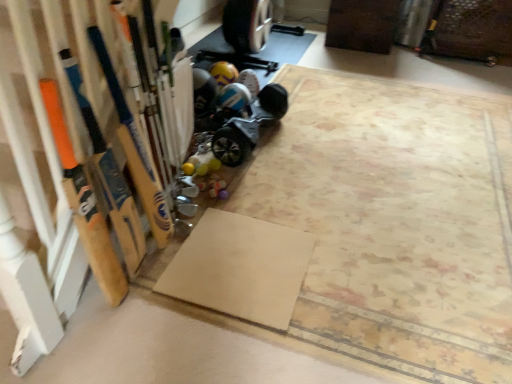
What do you see at coordinates (84, 204) in the screenshot?
I see `wooden baseball bat at left, the first baseball bat when ordered from left to right` at bounding box center [84, 204].

What do you see at coordinates (243, 107) in the screenshot?
I see `blue metallic hoverboard at lower center` at bounding box center [243, 107].

You are a GUI agent. You are given a task and a screenshot of the screen. Output one action in this format:
    pyautogui.click(x=<x>, y=<y>)
    Task: Click on the beige matte yoga mat at lower center
    
    Given the screenshot: What is the action you would take?
    pyautogui.click(x=240, y=268)

From a real-world perspective, is wooden baseball bat at left, which is the first baseball bat from right to left, beneath beige matte yoga mat at lower center?

No, from a real-world perspective, wooden baseball bat at left, which is the first baseball bat from right to left, is not below beige matte yoga mat at lower center.

Between wooden baseball bat at left, placed as the 2th baseball bat when sorted from left to right, and beige matte yoga mat at lower center, which one appears on the left side from the viewer's perspective?

From the viewer's perspective, wooden baseball bat at left, placed as the 2th baseball bat when sorted from left to right, appears more on the left side.

Looking at this image, between wooden baseball bat at left, which is the first baseball bat from right to left, and beige matte yoga mat at lower center, which one is positioned in front?

wooden baseball bat at left, which is the first baseball bat from right to left, is more forward.

Can you tell me how much wooden baseball bat at left, which is the first baseball bat from right to left, and beige matte yoga mat at lower center differ in facing direction?

0.312 degrees separate the facing orientations of wooden baseball bat at left, which is the first baseball bat from right to left, and beige matte yoga mat at lower center.

How different are the orientations of beige matte yoga mat at lower center and wooden baseball bat at left, placed as the 2th baseball bat when sorted from left to right, in degrees?

The angle between the facing direction of beige matte yoga mat at lower center and the facing direction of wooden baseball bat at left, placed as the 2th baseball bat when sorted from left to right, is 0.312 degrees.

Is beige matte yoga mat at lower center taller than wooden baseball bat at left, placed as the 2th baseball bat when sorted from left to right?

Incorrect, the height of beige matte yoga mat at lower center is not larger of that of wooden baseball bat at left, placed as the 2th baseball bat when sorted from left to right.

Is beige matte yoga mat at lower center situated inside wooden baseball bat at left, which is the first baseball bat from right to left, or outside?

beige matte yoga mat at lower center is located beyond the bounds of wooden baseball bat at left, which is the first baseball bat from right to left.

From a real-world perspective, which is physically above, beige matte yoga mat at lower center or wooden baseball bat at left, placed as the 2th baseball bat when sorted from left to right?

wooden baseball bat at left, placed as the 2th baseball bat when sorted from left to right, is physically above.

Consider the image. Can you confirm if blue metallic hoverboard at lower center is wider than wooden baseball bat at left, which is the first baseball bat from right to left?

Yes.

Is blue metallic hoverboard at lower center oriented away from wooden baseball bat at left, placed as the 2th baseball bat when sorted from left to right?

No, blue metallic hoverboard at lower center is not facing the opposite direction of wooden baseball bat at left, placed as the 2th baseball bat when sorted from left to right.

Is blue metallic hoverboard at lower center positioned behind wooden baseball bat at left, which is the first baseball bat from right to left?

Yes, blue metallic hoverboard at lower center is further from the camera.

Does wooden baseball bat at left, which ranks as the 2th baseball bat in right-to-left order, come in front of blue metallic hoverboard at lower center?

Yes, it is.

From a real-world perspective, is wooden baseball bat at left, the first baseball bat when ordered from left to right, on top of blue metallic hoverboard at lower center?

Correct, in the physical world, wooden baseball bat at left, the first baseball bat when ordered from left to right, is higher than blue metallic hoverboard at lower center.

Do you think wooden baseball bat at left, the first baseball bat when ordered from left to right, is within blue metallic hoverboard at lower center, or outside of it?

wooden baseball bat at left, the first baseball bat when ordered from left to right, is located beyond the bounds of blue metallic hoverboard at lower center.

What are the coordinates of `car above the wooden baseball bat at left, which ranks as the 2th baseball bat in right-to-left order (from the image's perspective)` in the screenshot? It's located at (243, 107).

From the image's perspective, which one is positioned lower, wooden baseball bat at left, the first baseball bat when ordered from left to right, or beige matte yoga mat at lower center?

beige matte yoga mat at lower center is shown below in the image.

Is there a large distance between wooden baseball bat at left, the first baseball bat when ordered from left to right, and beige matte yoga mat at lower center?

That's not correct — wooden baseball bat at left, the first baseball bat when ordered from left to right, is a little close to beige matte yoga mat at lower center.

Is wooden baseball bat at left, the first baseball bat when ordered from left to right, not within beige matte yoga mat at lower center?

Absolutely, wooden baseball bat at left, the first baseball bat when ordered from left to right, is external to beige matte yoga mat at lower center.

This screenshot has width=512, height=384. In order to click on yoga mat lying in front of the blue metallic hoverboard at lower center in this screenshot , I will do `click(240, 268)`.

How much distance is there between beige matte yoga mat at lower center and blue metallic hoverboard at lower center?

beige matte yoga mat at lower center and blue metallic hoverboard at lower center are 28.90 inches apart.

Is blue metallic hoverboard at lower center surrounded by beige matte yoga mat at lower center?

That's incorrect, blue metallic hoverboard at lower center is not inside beige matte yoga mat at lower center.

Is beige matte yoga mat at lower center turned away from blue metallic hoverboard at lower center?

No.

Could you tell me if blue metallic hoverboard at lower center is turned towards wooden baseball bat at left, which ranks as the 2th baseball bat in right-to-left order?

No, blue metallic hoverboard at lower center is not oriented towards wooden baseball bat at left, which ranks as the 2th baseball bat in right-to-left order.

Locate an element on the screen. The height and width of the screenshot is (384, 512). the 2nd baseball bat to the left of the blue metallic hoverboard at lower center, counting from the anchor's position is located at coordinates (84, 204).

Does blue metallic hoverboard at lower center appear on the left side of wooden baseball bat at left, the first baseball bat when ordered from left to right?

No.

How different are the orientations of blue metallic hoverboard at lower center and wooden baseball bat at left, the first baseball bat when ordered from left to right, in degrees?

They differ by 3.9 degrees in their facing directions.

In order to click on yoga mat lying on the right of wooden baseball bat at left, which is the first baseball bat from right to left in this screenshot , I will do `click(240, 268)`.

From the image's perspective, which baseball bat is the 2nd one above the beige matte yoga mat at lower center? Please provide its 2D coordinates.

[(135, 149)]

Which object lies nearer to the anchor point blue metallic hoverboard at lower center, beige matte yoga mat at lower center or wooden baseball bat at left, which ranks as the 2th baseball bat in right-to-left order?

Based on the image, beige matte yoga mat at lower center appears to be nearer to blue metallic hoverboard at lower center.

When comparing their distances from wooden baseball bat at left, which ranks as the 2th baseball bat in right-to-left order, does wooden baseball bat at left, which is the first baseball bat from right to left, or beige matte yoga mat at lower center seem closer?

wooden baseball bat at left, which is the first baseball bat from right to left, is positioned closer to the anchor wooden baseball bat at left, which ranks as the 2th baseball bat in right-to-left order.

Considering their positions, is blue metallic hoverboard at lower center positioned closer to beige matte yoga mat at lower center than wooden baseball bat at left, the first baseball bat when ordered from left to right?

wooden baseball bat at left, the first baseball bat when ordered from left to right, lies closer to beige matte yoga mat at lower center than the other object.

Considering their positions, is wooden baseball bat at left, which is the first baseball bat from right to left, positioned further to wooden baseball bat at left, which ranks as the 2th baseball bat in right-to-left order, than blue metallic hoverboard at lower center?

blue metallic hoverboard at lower center is further to wooden baseball bat at left, which ranks as the 2th baseball bat in right-to-left order.

Based on their spatial positions, is wooden baseball bat at left, the first baseball bat when ordered from left to right, or blue metallic hoverboard at lower center closer to wooden baseball bat at left, placed as the 2th baseball bat when sorted from left to right?

The object closer to wooden baseball bat at left, placed as the 2th baseball bat when sorted from left to right, is wooden baseball bat at left, the first baseball bat when ordered from left to right.

Estimate the real-world distances between objects in this image. Which object is further from wooden baseball bat at left, which ranks as the 2th baseball bat in right-to-left order, blue metallic hoverboard at lower center or beige matte yoga mat at lower center?

blue metallic hoverboard at lower center lies further to wooden baseball bat at left, which ranks as the 2th baseball bat in right-to-left order, than the other object.

Looking at the image, which one is located closer to beige matte yoga mat at lower center, wooden baseball bat at left, placed as the 2th baseball bat when sorted from left to right, or wooden baseball bat at left, which ranks as the 2th baseball bat in right-to-left order?

wooden baseball bat at left, placed as the 2th baseball bat when sorted from left to right, lies closer to beige matte yoga mat at lower center than the other object.

Considering their positions, is blue metallic hoverboard at lower center positioned further to wooden baseball bat at left, which is the first baseball bat from right to left, than wooden baseball bat at left, the first baseball bat when ordered from left to right?

blue metallic hoverboard at lower center.

The width and height of the screenshot is (512, 384). I want to click on yoga mat located between wooden baseball bat at left, which ranks as the 2th baseball bat in right-to-left order, and blue metallic hoverboard at lower center in the depth direction, so click(x=240, y=268).

Identify the location of baseball bat between wooden baseball bat at left, the first baseball bat when ordered from left to right, and blue metallic hoverboard at lower center, along the z-axis. This screenshot has width=512, height=384. (135, 149).

Identify the location of yoga mat positioned between wooden baseball bat at left, which is the first baseball bat from right to left, and blue metallic hoverboard at lower center from near to far. The width and height of the screenshot is (512, 384). click(x=240, y=268).

Image resolution: width=512 pixels, height=384 pixels. What are the coordinates of `baseball bat situated between wooden baseball bat at left, the first baseball bat when ordered from left to right, and beige matte yoga mat at lower center from left to right` in the screenshot? It's located at (x=135, y=149).